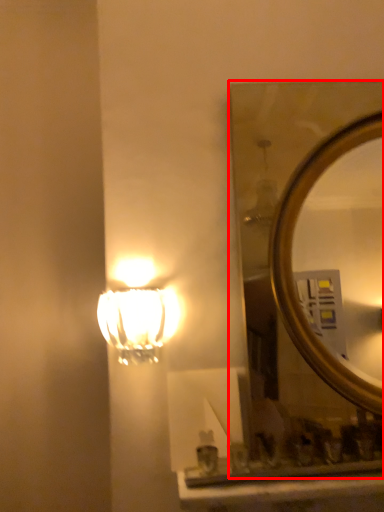
Question: Where is mirror (annotated by the red box) located in relation to lamp in the image?

Choices:
 (A) left
 (B) right

Answer: (B)